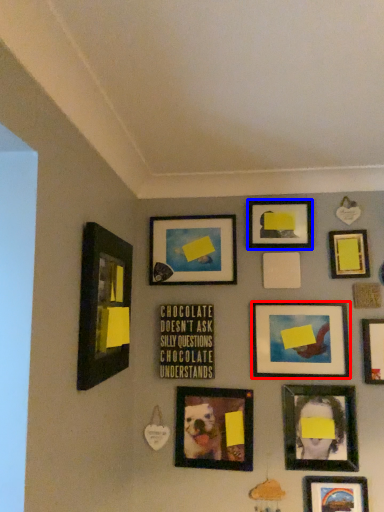
Question: Among these objects, which one is farthest to the camera, picture frame (highlighted by a red box) or picture frame (highlighted by a blue box)?

Choices:
 (A) picture frame
 (B) picture frame

Answer: (B)